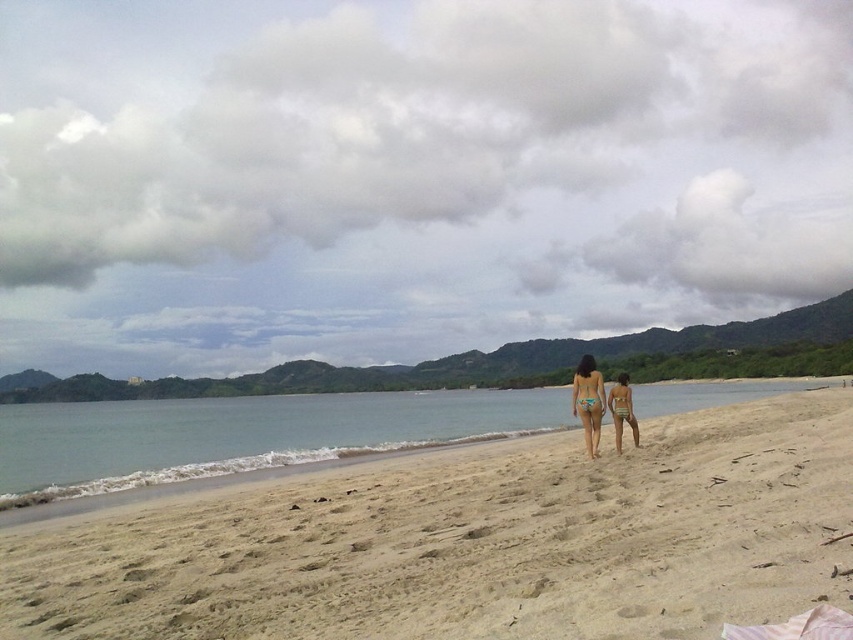
Who is higher up, light beige sand at center or teal bikini at center?

Positioned higher is teal bikini at center.

Between point (556, 524) and point (582, 372), which one is positioned behind?

Positioned behind is point (582, 372).

Find the location of `light beige sand at center`. light beige sand at center is located at coordinates coord(473,541).

Which is in front, point (573, 384) or point (618, 410)?

Positioned in front is point (573, 384).

Which is more to the left, light blue fabric bikini at center or green striped bikini at center?

light blue fabric bikini at center

Is point (604, 404) closer to camera compared to point (619, 413)?

That is True.

This screenshot has height=640, width=853. In order to click on light blue fabric bikini at center in this screenshot , I will do `click(589, 394)`.

Which of these two, teal bikini at center or green matte bikini at center, stands shorter?

With less height is green matte bikini at center.

Which is behind, point (584, 371) or point (634, 435)?

Positioned behind is point (634, 435).

The width and height of the screenshot is (853, 640). I want to click on teal bikini at center, so click(x=589, y=401).